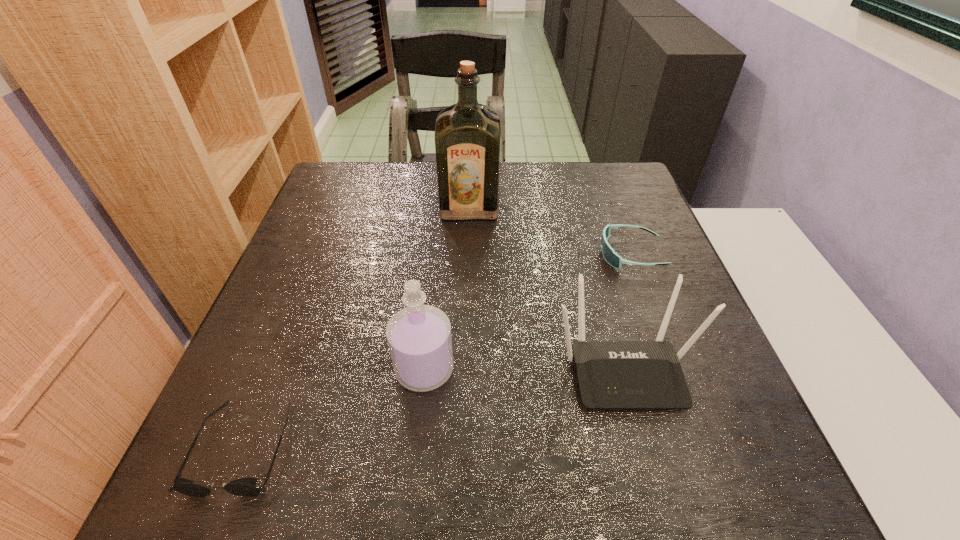
Identify the location of liquor. (467, 134).

The width and height of the screenshot is (960, 540). I want to click on the tallest object, so click(467, 134).

The image size is (960, 540). I want to click on perfume, so click(419, 338).

At what (x,y) coordinates should I click in order to perform the action: click on the third shortest object. Please return your answer as a coordinate pair (x, y). This screenshot has width=960, height=540. Looking at the image, I should click on (611, 374).

You are a GUI agent. You are given a task and a screenshot of the screen. Output one action in this format:
    pyautogui.click(x=<x>, y=<y>)
    Task: Click on the goggles
    
    Given the screenshot: What is the action you would take?
    pyautogui.click(x=613, y=259)

This screenshot has height=540, width=960. What are the coordinates of `the leftmost object` in the screenshot? It's located at (245, 487).

Locate an element on the screen. free point located on the label of the tallest object is located at coordinates (468, 248).

This screenshot has width=960, height=540. I want to click on vacant space located on the back of the perfume, so click(433, 287).

Locate an element on the screen. Image resolution: width=960 pixels, height=540 pixels. blank area located on the front-facing side of the router is located at coordinates (646, 448).

Find the location of a particular element. free space located 0.130m on the front-facing side of the fourth nearest object is located at coordinates (544, 254).